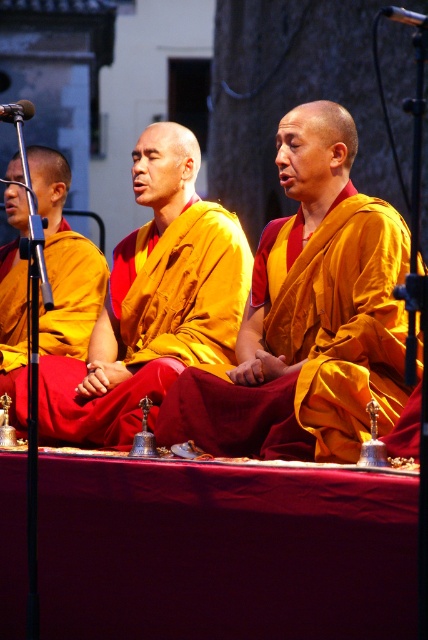
Question: Which point is closer to the camera taking this photo?

Choices:
 (A) (314, 534)
 (B) (65, 326)
 (C) (418, 12)

Answer: (A)

Question: Does burgundy fabric tablecloth at center come in front of matte gold robe at center?

Choices:
 (A) no
 (B) yes

Answer: (B)

Question: Which of these objects is positioned closest to the metallic microphone at left?

Choices:
 (A) matte gold robe at left
 (B) shiny gold robe at center
 (C) metallic silver microphone at upper right

Answer: (A)

Question: Which object is the farthest from the metallic silver microphone at upper right?

Choices:
 (A) shiny gold robe at center
 (B) matte gold robe at center
 (C) burgundy fabric tablecloth at center
 (D) metallic microphone at left

Answer: (C)

Question: Does burgundy fabric tablecloth at center come in front of metallic silver microphone at upper right?

Choices:
 (A) no
 (B) yes

Answer: (A)

Question: Can you confirm if burgundy fabric tablecloth at center is thinner than matte gold robe at center?

Choices:
 (A) yes
 (B) no

Answer: (B)